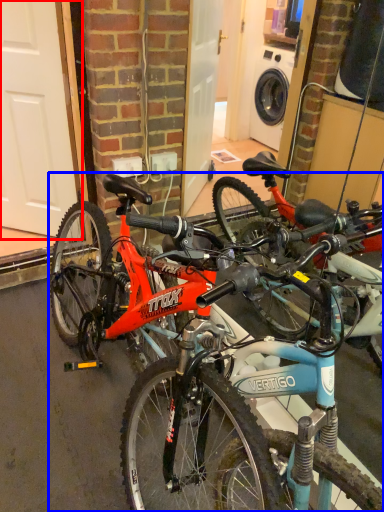
Question: Which point is further to the camera, garage door (highlighted by a red box) or bicycle (highlighted by a blue box)?

Choices:
 (A) garage door
 (B) bicycle

Answer: (A)